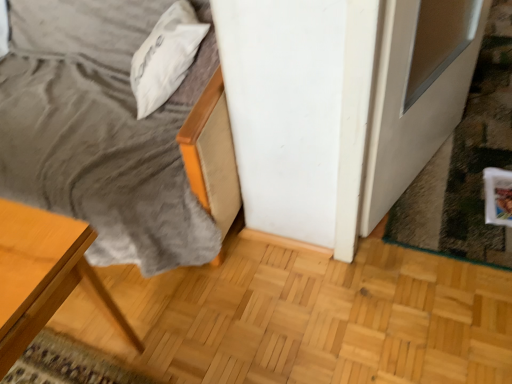
Find the location of `white soft pillow at upper left`. white soft pillow at upper left is located at coordinates (165, 56).

Image resolution: width=512 pixels, height=384 pixels. Describe the element at coordinates (165, 56) in the screenshot. I see `white soft pillow at upper left` at that location.

In order to face white soft pillow at upper left, should I rotate leftwards or rightwards?

You should look left and rotate roughly 11.833 degrees.

Measure the distance between point (175, 5) and camera.

4.66 feet.

Where is `white glossy screen door at lower right`? The height and width of the screenshot is (384, 512). white glossy screen door at lower right is located at coordinates (417, 92).

This screenshot has width=512, height=384. What do you see at coordinates (417, 92) in the screenshot? I see `white glossy screen door at lower right` at bounding box center [417, 92].

Locate an element on the screen. white soft pillow at upper left is located at coordinates (165, 56).

Is white glossy screen door at lower right to the right of white soft pillow at upper left from the viewer's perspective?

Indeed, white glossy screen door at lower right is positioned on the right side of white soft pillow at upper left.

Considering their positions, is white glossy screen door at lower right located in front of or behind white soft pillow at upper left?

white glossy screen door at lower right is positioned closer to the viewer than white soft pillow at upper left.

Does point (420, 151) appear closer or farther from the camera than point (190, 13)?

Point (420, 151).

From the image's perspective, relative to white soft pillow at upper left, is white glossy screen door at lower right above or below?

white glossy screen door at lower right is below white soft pillow at upper left.

From a real-world perspective, is white glossy screen door at lower right above or below white soft pillow at upper left?

From a real-world perspective, white glossy screen door at lower right is physically below white soft pillow at upper left.

Based on the photo, is white glossy screen door at lower right thinner than white soft pillow at upper left?

Correct, the width of white glossy screen door at lower right is less than that of white soft pillow at upper left.

Does white glossy screen door at lower right have a lesser height compared to white soft pillow at upper left?

Incorrect, the height of white glossy screen door at lower right does not fall short of that of white soft pillow at upper left.

Considering the sizes of objects white glossy screen door at lower right and white soft pillow at upper left in the image provided, who is smaller, white glossy screen door at lower right or white soft pillow at upper left?

white soft pillow at upper left is smaller.

Is white soft pillow at upper left completely or partially inside white glossy screen door at lower right?

Actually, white soft pillow at upper left is outside white glossy screen door at lower right.

Is white glossy screen door at lower right placed right next to white soft pillow at upper left?

No, white glossy screen door at lower right is not in contact with white soft pillow at upper left.

Is white glossy screen door at lower right turned away from white soft pillow at upper left?

Yes, white glossy screen door at lower right's orientation is away from white soft pillow at upper left.

How different are the orientations of white glossy screen door at lower right and white soft pillow at upper left in degrees?

118 degrees.

Identify the location of pillow that is on the left side of white glossy screen door at lower right. (165, 56).

Between white soft pillow at upper left and white glossy screen door at lower right, which one appears on the right side from the viewer's perspective?

white glossy screen door at lower right.

Is the position of white soft pillow at upper left less distant than that of white glossy screen door at lower right?

No, it is behind white glossy screen door at lower right.

Is point (148, 105) positioned in front of point (430, 43)?

That is False.

Looking at this image, from the image's perspective, which is below, white soft pillow at upper left or white glossy screen door at lower right?

white glossy screen door at lower right appears lower in the image.

From a real-world perspective, which object rests below the other?

white glossy screen door at lower right is physically lower.

Between white soft pillow at upper left and white glossy screen door at lower right, which one has larger width?

Wider between the two is white soft pillow at upper left.

Who is taller, white soft pillow at upper left or white glossy screen door at lower right?

white glossy screen door at lower right.

Can you confirm if white soft pillow at upper left is smaller than white glossy screen door at lower right?

Indeed, white soft pillow at upper left has a smaller size compared to white glossy screen door at lower right.

Is white soft pillow at upper left not inside white glossy screen door at lower right?

white soft pillow at upper left lies outside white glossy screen door at lower right's area.

Would you consider white soft pillow at upper left to be distant from white glossy screen door at lower right?

No, white soft pillow at upper left is not far away from white glossy screen door at lower right.

Could you tell me if white soft pillow at upper left is turned towards white glossy screen door at lower right?

No, white soft pillow at upper left does not turn towards white glossy screen door at lower right.

Can you tell me how much white soft pillow at upper left and white glossy screen door at lower right differ in facing direction?

The angle between the facing direction of white soft pillow at upper left and the facing direction of white glossy screen door at lower right is 118 degrees.

Locate an element on the screen. screen door in front of the white soft pillow at upper left is located at coordinates (417, 92).

Locate an element on the screen. This screenshot has height=384, width=512. pillow above the white glossy screen door at lower right (from the image's perspective) is located at coordinates (165, 56).

The image size is (512, 384). I want to click on screen door lying below the white soft pillow at upper left (from the image's perspective), so click(x=417, y=92).